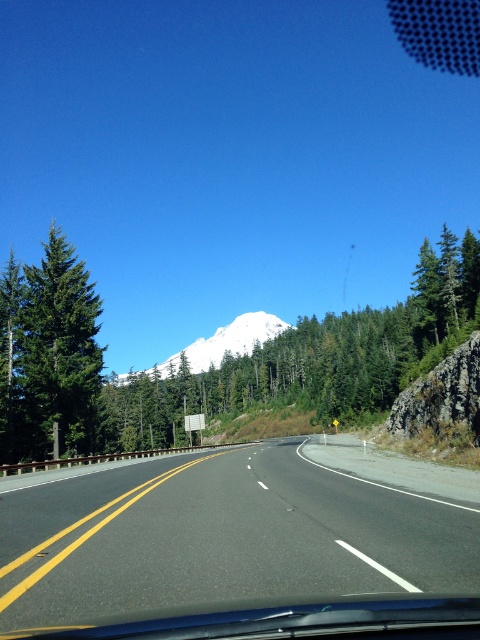
Which is more to the right, green matte tree at left or transparent glass windshield at center?

transparent glass windshield at center

Does point (36, 300) come farther from viewer compared to point (105, 637)?

Yes, it is behind point (105, 637).

Identify the location of green matte tree at left. Image resolution: width=480 pixels, height=640 pixels. (48, 355).

Between point (261, 566) and point (72, 380), which one is positioned behind?

The point (72, 380) is behind.

Where is `black asphalt road at center`? The width and height of the screenshot is (480, 640). black asphalt road at center is located at coordinates (222, 538).

Locate an element on the screen. black asphalt road at center is located at coordinates (222, 538).

Does transparent glass windshield at center have a lesser width compared to white snow-covered mountain at center?

Correct, transparent glass windshield at center's width is less than white snow-covered mountain at center's.

Does transparent glass windshield at center appear on the left side of white snow-covered mountain at center?

In fact, transparent glass windshield at center is to the right of white snow-covered mountain at center.

Who is more distant from viewer, (308, 628) or (272, 324)?

The point (272, 324) is behind.

The image size is (480, 640). What are the coordinates of `transparent glass windshield at center` in the screenshot? It's located at (297, 621).